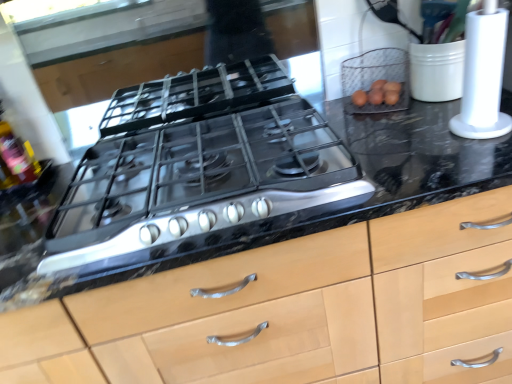
What are the coordinates of `free location to the right of translucent plastic bottle at left` in the screenshot? It's located at (57, 184).